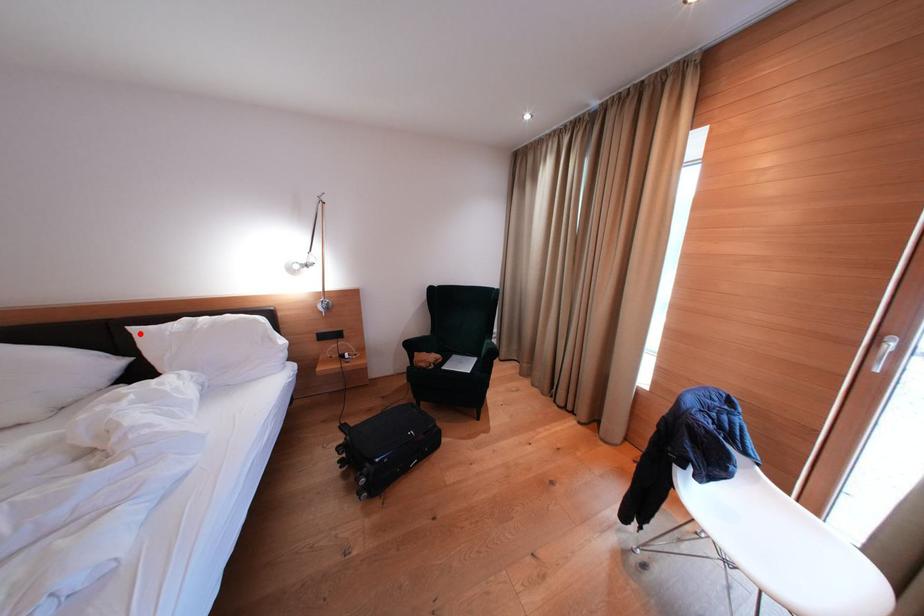
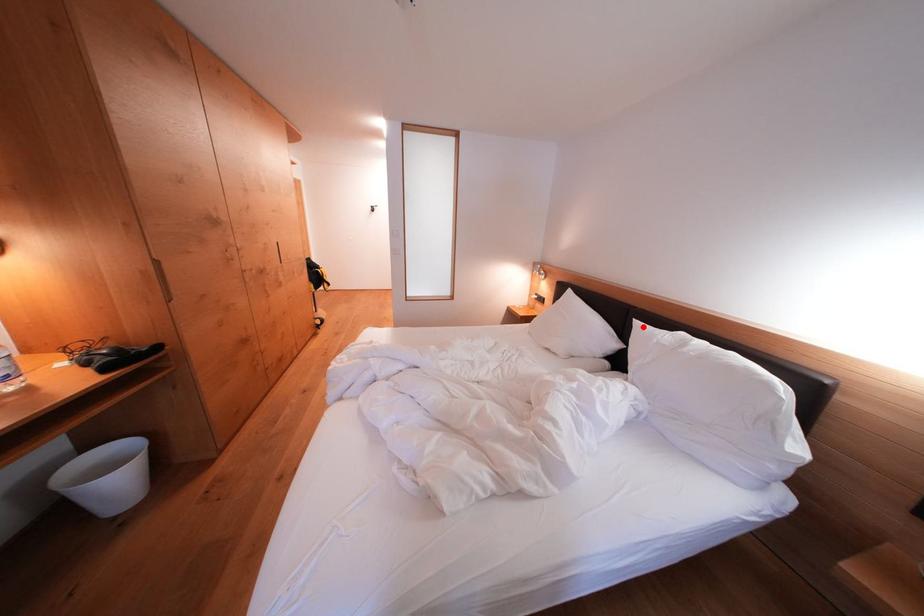
I am providing you with two images of the same scene from different viewpoints. A red point is marked on the first image and another point is marked on the second image. Is the red point in image1 aligned with the point shown in image2?

Yes